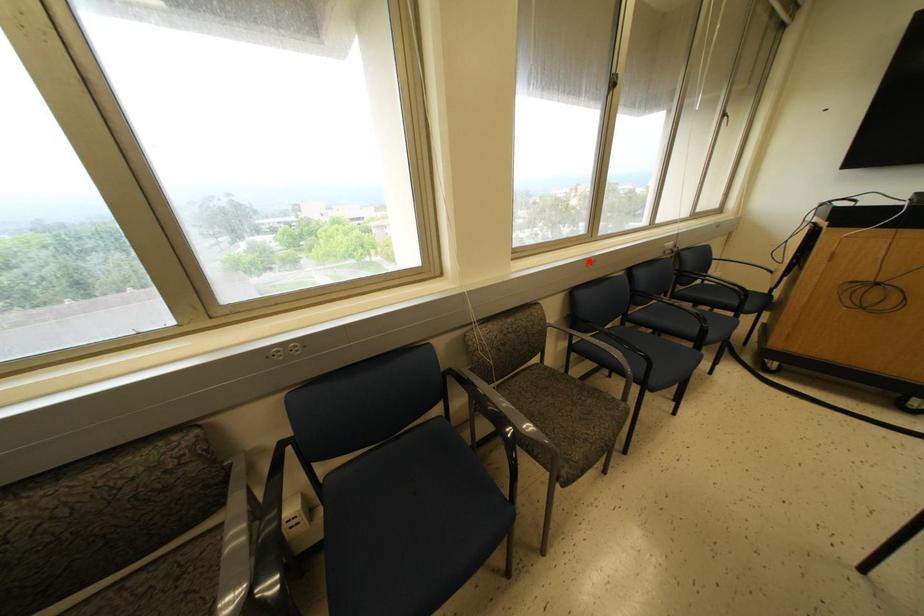
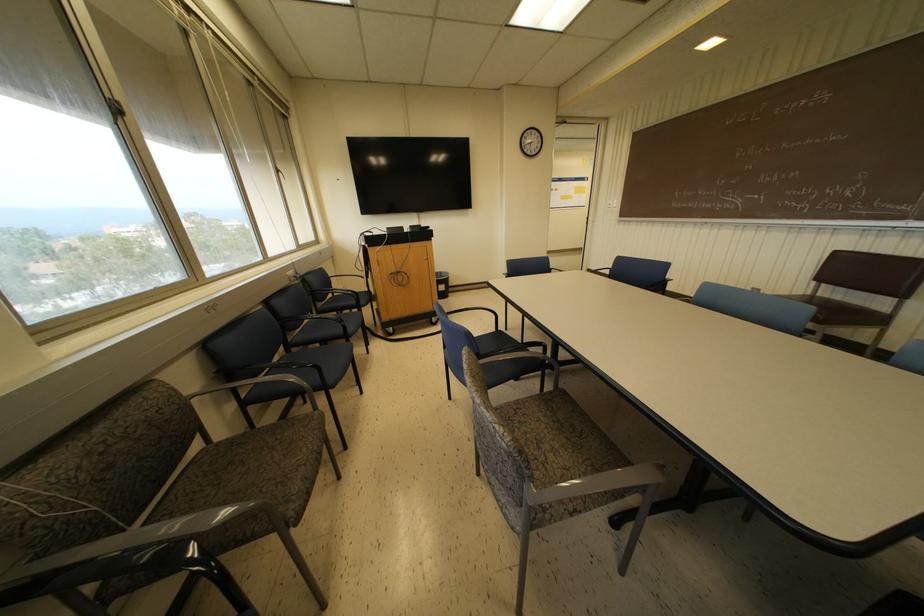
Locate, in the second image, the point that corresponds to the highlighted location in the first image.

(209, 307)